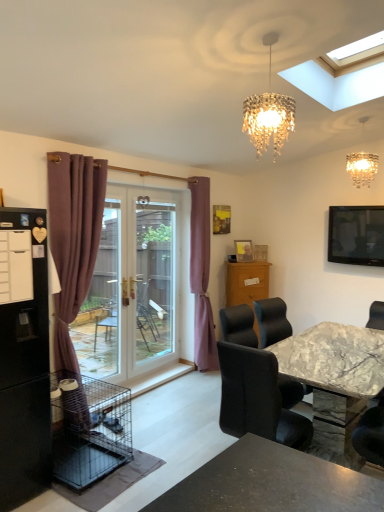
Locate an element on the screen. This screenshot has height=512, width=384. mauve velvet curtain at left, placed as the 2th curtain when sorted from back to front is located at coordinates (73, 239).

Measure the distance between flat screen tv at upper right and camera.

flat screen tv at upper right and camera are 4.03 meters apart.

What do you see at coordinates (362, 167) in the screenshot?
I see `crystal glass chandelier at upper center` at bounding box center [362, 167].

Identify the location of wooden picture frame at center. The height and width of the screenshot is (512, 384). (243, 250).

This screenshot has width=384, height=512. In order to click on marble table at center in this screenshot , I will do `click(335, 381)`.

From the image's perspective, is black matte refrigerator at left under mauve velvet curtain at left, which is the 1th curtain in left-to-right order?

Correct, black matte refrigerator at left appears lower than mauve velvet curtain at left, which is the 1th curtain in left-to-right order, in the image.

Looking at this image, is mauve velvet curtain at left, the 2th curtain viewed from the right, at the back of black matte refrigerator at left?

Result: No.

Considering the points (50, 466) and (76, 279), which point is in front, point (50, 466) or point (76, 279)?

Positioned in front is point (50, 466).

Relative to black wire birdcage at lower left, is black matte refrigerator at left in front or behind?

black matte refrigerator at left is in front of black wire birdcage at lower left.

In the image, is black matte refrigerator at left on the left side or the right side of black wire birdcage at lower left?

In the image, black matte refrigerator at left appears on the left side of black wire birdcage at lower left.

Is black matte refrigerator at left completely or partially outside of black wire birdcage at lower left?

Indeed, black matte refrigerator at left is completely outside black wire birdcage at lower left.

Is point (1, 332) farther from viewer compared to point (113, 459)?

No, (1, 332) is closer to viewer.

From a real-world perspective, does marble table at center stand above black matte refrigerator at left?

No.

Which of these two, marble table at center or black matte refrigerator at left, is thinner?

black matte refrigerator at left.

Considering the sizes of marble table at center and black matte refrigerator at left in the image, is marble table at center taller or shorter than black matte refrigerator at left?

Clearly, marble table at center is shorter compared to black matte refrigerator at left.

From the image's perspective, would you say marble table at center is shown under black matte refrigerator at left?

Indeed, from the image's perspective, marble table at center is shown beneath black matte refrigerator at left.

Considering the sizes of marble table at center and flat screen tv at upper right in the image, is marble table at center bigger or smaller than flat screen tv at upper right?

Clearly, marble table at center is larger in size than flat screen tv at upper right.

Between marble table at center and flat screen tv at upper right, which one has larger width?

marble table at center is wider.

From the image's perspective, is wooden cabinet at center above mauve fabric curtain at center, placed as the 1th curtain when sorted from right to left?

No, from the image's perspective, wooden cabinet at center is not on top of mauve fabric curtain at center, placed as the 1th curtain when sorted from right to left.

Is there a large distance between wooden cabinet at center and mauve fabric curtain at center, acting as the 1th curtain starting from the back?

wooden cabinet at center is near mauve fabric curtain at center, acting as the 1th curtain starting from the back, not far away.

Does point (226, 289) lie in front of point (205, 210)?

No, (226, 289) is further to viewer.

From a real-world perspective, who is located lower, wooden cabinet at center or mauve fabric curtain at center, positioned as the second curtain in front-to-back order?

wooden cabinet at center.

Image resolution: width=384 pixels, height=512 pixels. Identify the location of cabinetry above the marble table at center (from a real-world perspective). (247, 282).

Looking at this image, would you say wooden cabinet at center is to the left or to the right of marble table at center in the picture?

wooden cabinet at center is to the left of marble table at center.

Measure the distance from wooden cabinet at center to marble table at center.

wooden cabinet at center and marble table at center are 6.61 feet apart.

Is crystal glass chandelier at upper center at the back of transparent glass screen door at center?

That's not correct — transparent glass screen door at center is not looking away from crystal glass chandelier at upper center.

Between transparent glass screen door at center and crystal glass chandelier at upper center, which one appears on the left side from the viewer's perspective?

A: From the viewer's perspective, transparent glass screen door at center appears more on the left side.

From a real-world perspective, is transparent glass screen door at center under crystal glass chandelier at upper center?

Yes, from a real-world perspective, transparent glass screen door at center is below crystal glass chandelier at upper center.

This screenshot has width=384, height=512. What are the coordinates of `the 1st curtain behind when counting from the black matte refrigerator at left` in the screenshot? It's located at (73, 239).

There is a black wire birdcage at lower left. Identify the location of refrigerator above it (from a real-world perspective). (24, 357).

From the image, which object appears to be farther from wooden cabinet at center, transparent glass screen door at center or wooden picture frame at center?

transparent glass screen door at center is positioned further to the anchor wooden cabinet at center.

Which object lies further to the anchor point wooden cabinet at center, wooden picture frame at center or black wire birdcage at lower left?

black wire birdcage at lower left is positioned further to the anchor wooden cabinet at center.

When comparing their distances from mauve velvet curtain at left, placed as the 2th curtain when sorted from back to front, does black wire birdcage at lower left or black matte refrigerator at left seem further?

Based on the image, black wire birdcage at lower left appears to be further to mauve velvet curtain at left, placed as the 2th curtain when sorted from back to front.

Considering their positions, is transparent glass screen door at center positioned closer to flat screen tv at upper right than wooden cabinet at center?

Among the two, wooden cabinet at center is located nearer to flat screen tv at upper right.

When comparing their distances from flat screen tv at upper right, does wooden cabinet at center or marble table at center seem further?

Among the two, wooden cabinet at center is located further to flat screen tv at upper right.

Estimate the real-world distances between objects in this image. Which object is further from mauve velvet curtain at left, which is the 1th curtain in left-to-right order, wooden picture frame at center or marble-textured chair at lower right?

Based on the image, wooden picture frame at center appears to be further to mauve velvet curtain at left, which is the 1th curtain in left-to-right order.

Considering their positions, is marble table at center positioned further to black matte refrigerator at left than wooden cabinet at center?

wooden cabinet at center lies further to black matte refrigerator at left than the other object.

Looking at the image, which one is located closer to crystal glass chandelier at upper center, flat screen tv at upper right or wooden picture frame at center?

flat screen tv at upper right.

Locate an element on the screen. The height and width of the screenshot is (512, 384). cabinetry between black matte refrigerator at left and flat screen tv at upper right in the horizontal direction is located at coordinates (247, 282).

Locate an element on the screen. The height and width of the screenshot is (512, 384). kitchen & dining room table situated between mauve velvet curtain at left, placed as the 2th curtain when sorted from back to front, and flat screen tv at upper right from left to right is located at coordinates (335, 381).

Locate an element on the screen. screen door positioned between marble table at center and wooden picture frame at center from near to far is located at coordinates (152, 279).

Where is `screen door between mauve velvet curtain at left, the 2th curtain viewed from the right, and crystal glass chandelier at upper center`? screen door between mauve velvet curtain at left, the 2th curtain viewed from the right, and crystal glass chandelier at upper center is located at coordinates (152, 279).